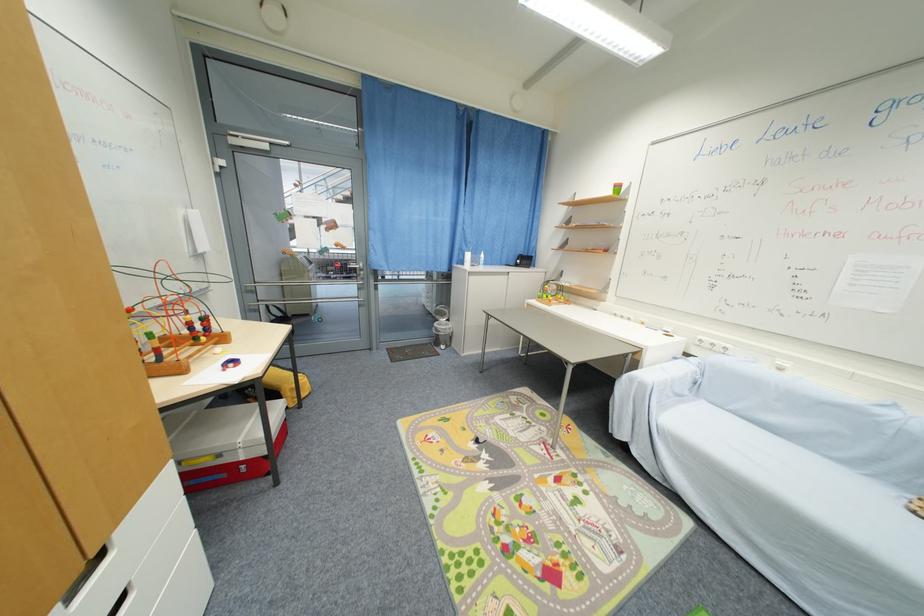
Where is `red box handle`? The width and height of the screenshot is (924, 616). red box handle is located at coordinates (200, 479).